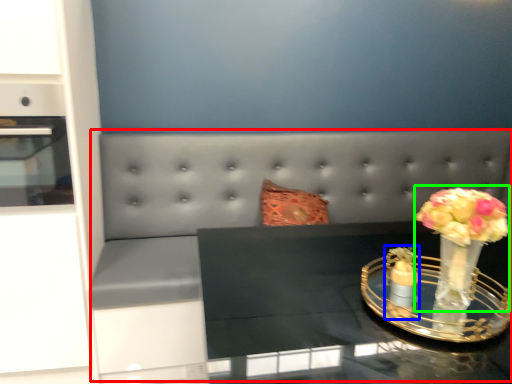
Question: Based on their relative distances, which object is farther from couch (highlighted by a red box)? Choose from candle holder (highlighted by a blue box) and floral arrangement (highlighted by a green box).

Choices:
 (A) candle holder
 (B) floral arrangement

Answer: (B)